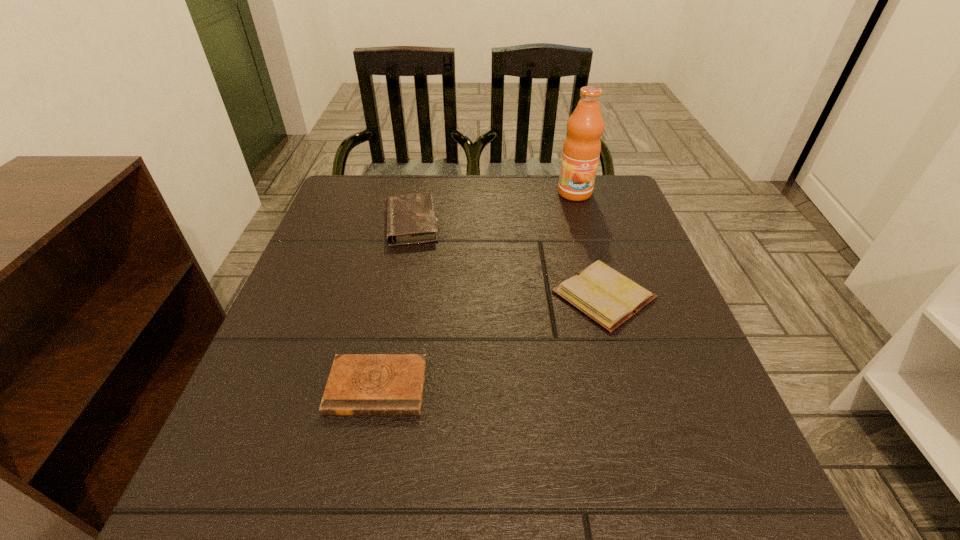
You are a GUI agent. You are given a task and a screenshot of the screen. Output one action in this format:
    pyautogui.click(x=<x>, y=<y>)
    Task: Click on the free spot at the right edge of the desktop
    The height and width of the screenshot is (540, 960).
    Given the screenshot: What is the action you would take?
    pyautogui.click(x=667, y=383)

The height and width of the screenshot is (540, 960). In order to click on vacant region at the far left corner of the desktop in this screenshot , I will do `click(336, 204)`.

Locate an element on the screen. vacant space at the near left corner of the desktop is located at coordinates (196, 509).

The image size is (960, 540). Identify the location of vacant space at the far right corner of the desktop. (623, 207).

Where is `free space between the nearest diary and the farthest object`? free space between the nearest diary and the farthest object is located at coordinates (476, 290).

Where is `free spot between the nearest diary and the farthest diary`? This screenshot has width=960, height=540. free spot between the nearest diary and the farthest diary is located at coordinates (395, 305).

Locate an element on the screen. The width and height of the screenshot is (960, 540). unoccupied position between the second farthest diary and the farthest object is located at coordinates (589, 244).

The image size is (960, 540). In order to click on vacant space in between the second tallest object and the third farthest object in this screenshot , I will do `click(508, 259)`.

You are a GUI agent. You are given a task and a screenshot of the screen. Output one action in this format:
    pyautogui.click(x=<x>, y=<y>)
    Task: Click on the free space that is in between the nearest object and the farthest object
    Image resolution: width=960 pixels, height=540 pixels.
    Given the screenshot: What is the action you would take?
    coord(476,290)

This screenshot has height=540, width=960. I want to click on free spot between the second farthest object and the nearest object, so click(395, 305).